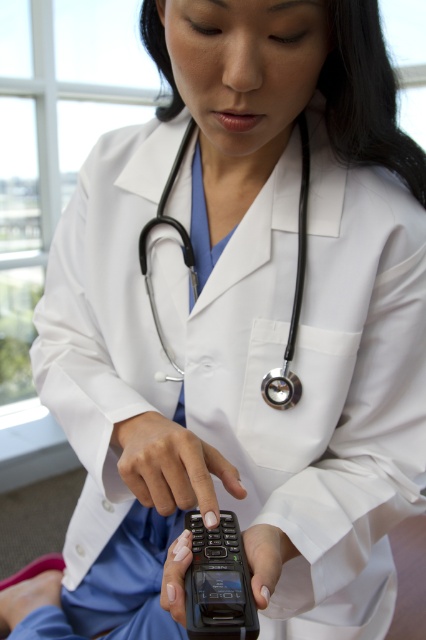
You are a patient in a hospital room and see the healthcare professional holding a black matte phone at center and a smooth skin hand at center. Which object is closer to you?

The smooth skin hand at center is closer to you because the black matte phone at center is behind it.

In the scene shown: You are a healthcare worker who needs to disinfect your stethoscope. The smooth skin hand at center is holding the black rubber stethoscope at center. Can you reach the stethoscope with your other hand to disinfect it without moving your current position?

The distance of smooth skin hand at center from black rubber stethoscope at center is 6.80 inches. Since the hand is already holding the stethoscope, the other hand can easily reach it to disinfect without needing to move position.

You are a patient in the waiting room and see the healthcare professional holding a flip phone. Which object is taller, the smooth skin hand at center or the black rubber stethoscope at center?

The smooth skin hand at center is not as tall as the black rubber stethoscope at center, so the black rubber stethoscope at center is taller.